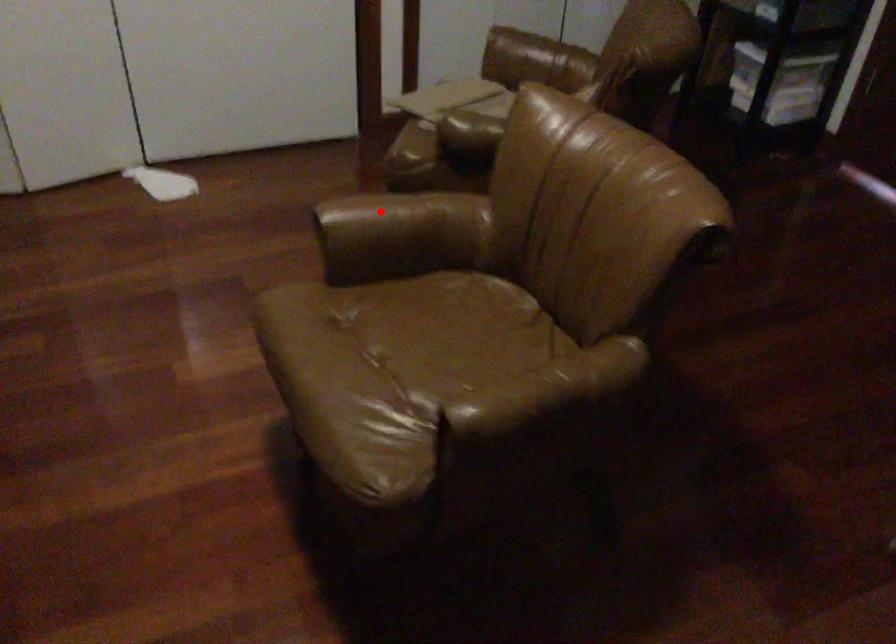
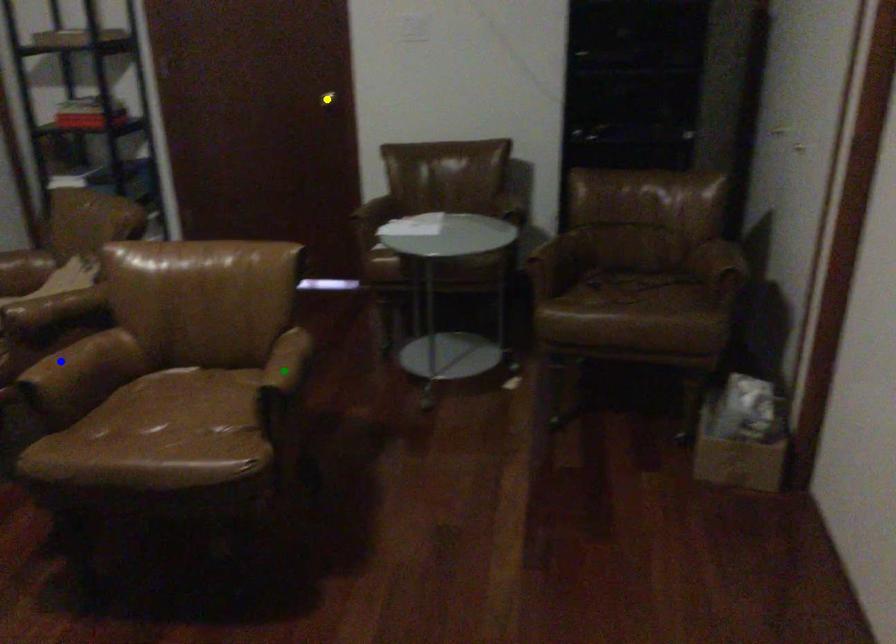
Question: I am providing you with two images of the same scene from different viewpoints. A red point is marked on the first image. You are given multiple points on the second image. Which spot in image 2 lines up with the point in image 1?

Choices:
 (A) blue point
 (B) yellow point
 (C) green point

Answer: (A)